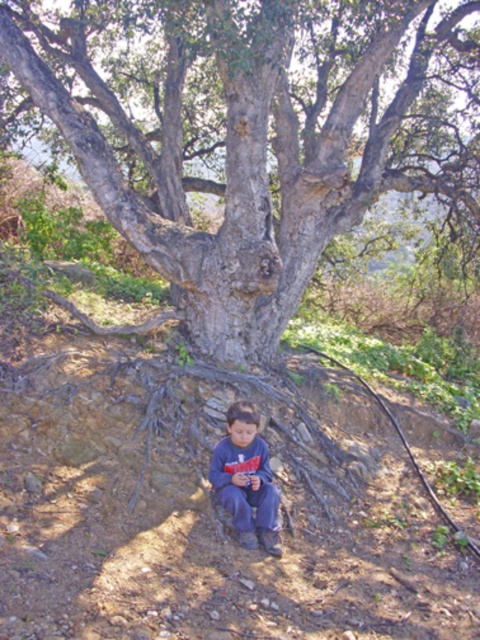
Question: Considering the relative positions of gray rough bark tree at center and dark blue jeans at lower center in the image provided, where is gray rough bark tree at center located with respect to dark blue jeans at lower center?

Choices:
 (A) below
 (B) above

Answer: (B)

Question: Does gray rough bark tree at center appear under dark blue jeans at lower center?

Choices:
 (A) no
 (B) yes

Answer: (A)

Question: Does gray rough bark tree at center lie behind dark blue jeans at lower center?

Choices:
 (A) yes
 (B) no

Answer: (A)

Question: Which point appears closest to the camera in this image?

Choices:
 (A) (247, 403)
 (B) (263, 68)

Answer: (A)